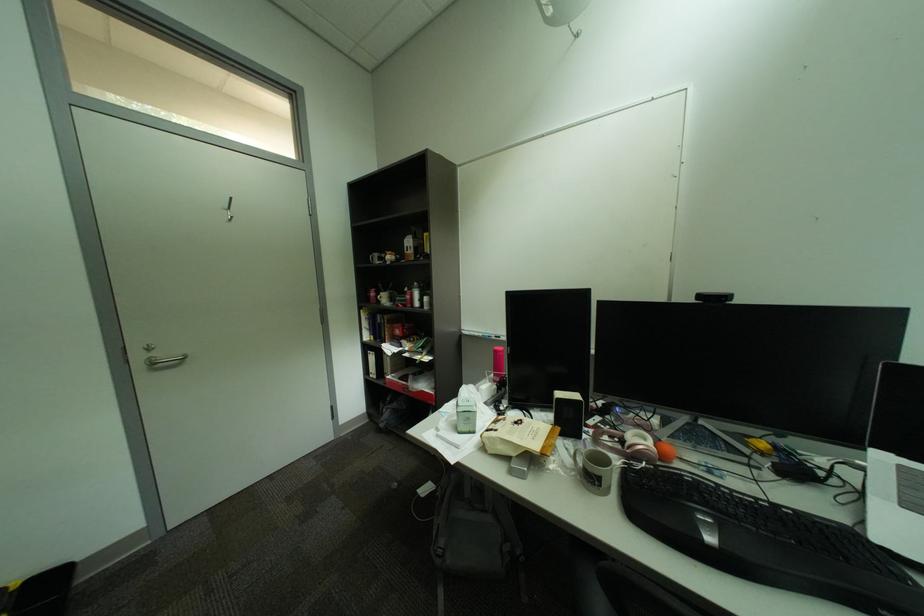
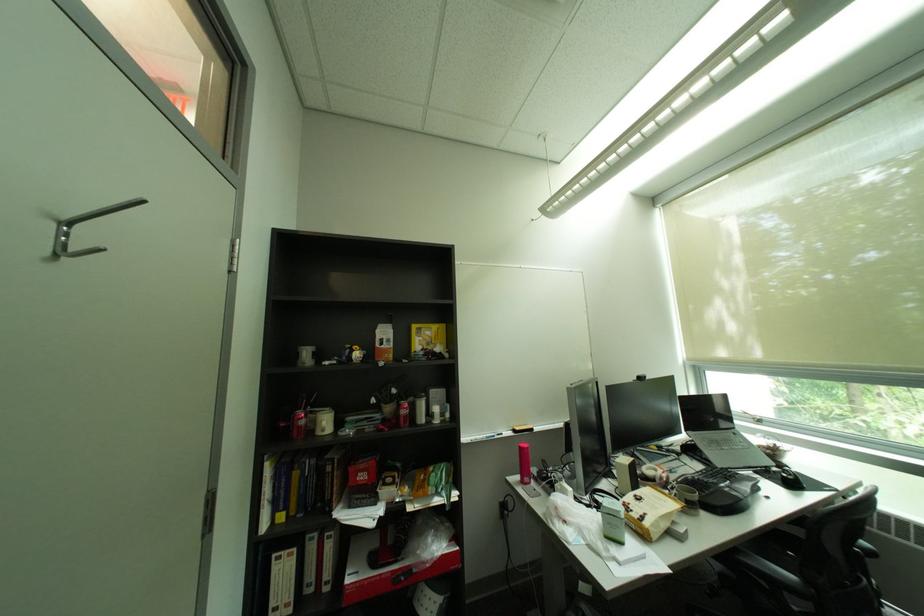
Find the pixel in the second image that matches (x=787, y=507) in the first image.

(712, 472)